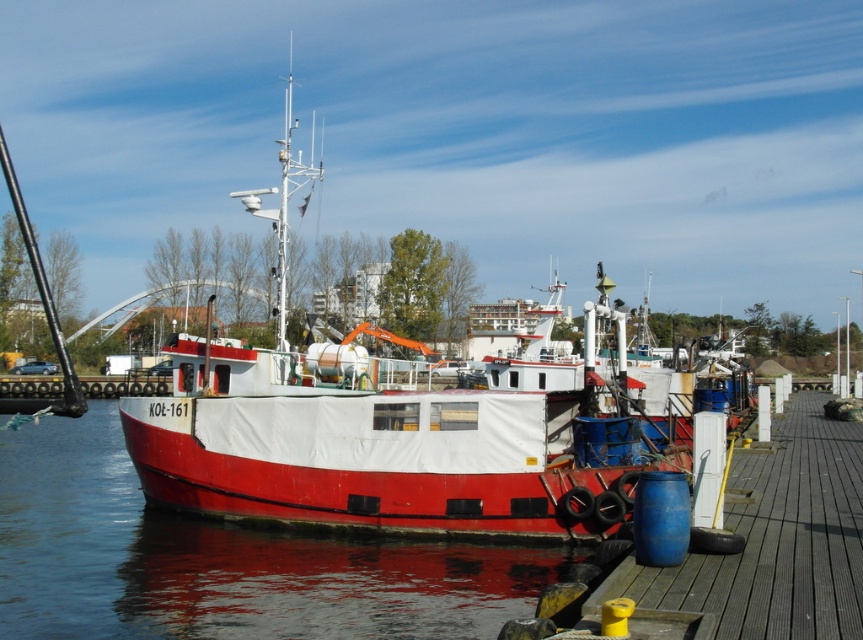
Question: Which of these objects is positioned farthest from the wooden dock at center?

Choices:
 (A) red matte boat at center
 (B) red matte water at center

Answer: (A)

Question: Which object appears closest to the camera in this image?

Choices:
 (A) red matte water at center
 (B) red matte boat at center

Answer: (B)

Question: Does red matte water at center appear on the left side of wooden dock at center?

Choices:
 (A) yes
 (B) no

Answer: (A)

Question: Can you confirm if red matte water at center is positioned to the right of wooden dock at center?

Choices:
 (A) yes
 (B) no

Answer: (B)

Question: Does red matte boat at center appear over red matte water at center?

Choices:
 (A) yes
 (B) no

Answer: (A)

Question: Which object is positioned farthest from the red matte boat at center?

Choices:
 (A) red matte water at center
 (B) wooden dock at center

Answer: (B)